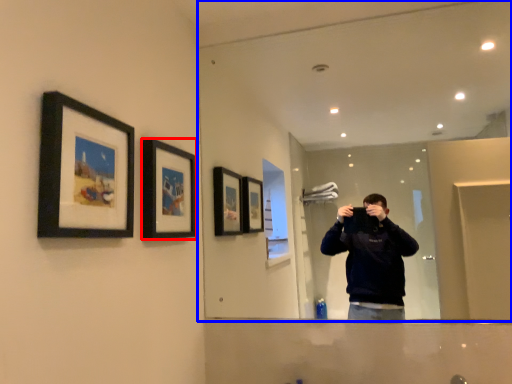
Question: Which point is further to the camera, picture frame (highlighted by a red box) or mirror (highlighted by a blue box)?

Choices:
 (A) picture frame
 (B) mirror

Answer: (B)